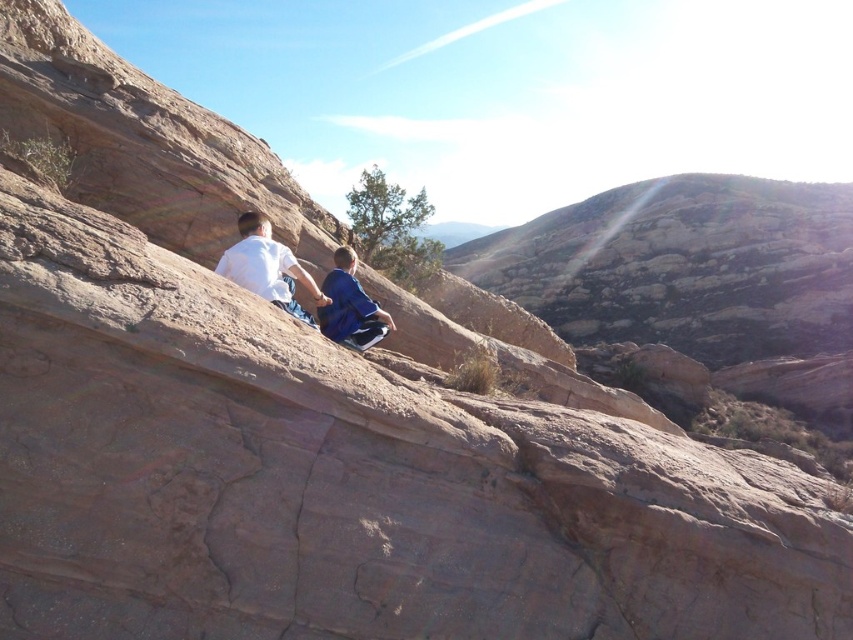
Question: Is white matte shirt at center further to camera compared to blue fabric pants at center?

Choices:
 (A) no
 (B) yes

Answer: (A)

Question: Among these points, which one is nearest to the camera?

Choices:
 (A) (265, 257)
 (B) (345, 269)

Answer: (A)

Question: Does white matte shirt at center have a greater width compared to blue fabric pants at center?

Choices:
 (A) yes
 (B) no

Answer: (A)

Question: Which of the following is the farthest from the observer?

Choices:
 (A) blue fabric pants at center
 (B) white matte shirt at center

Answer: (A)

Question: Does white matte shirt at center appear under blue fabric pants at center?

Choices:
 (A) yes
 (B) no

Answer: (B)

Question: Which point is farther to the camera?

Choices:
 (A) (282, 298)
 (B) (344, 316)

Answer: (B)